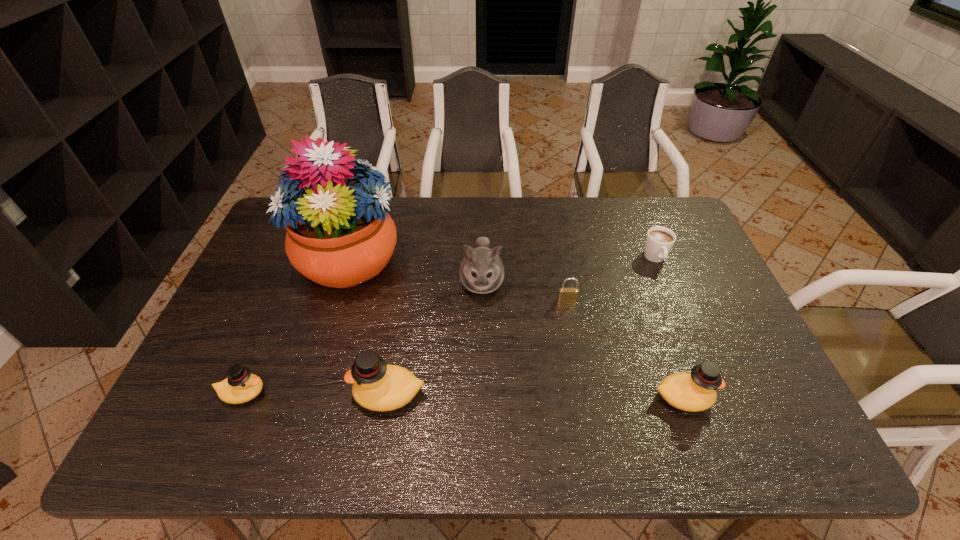
What are the coordinates of `vacant space located 0.050m on the front-facing side of the tallest duck` in the screenshot? It's located at click(330, 394).

At what (x,y) coordinates should I click in order to perform the action: click on free region located on the front-facing side of the tallest duck. Please return your answer as a coordinate pair (x, y). The width and height of the screenshot is (960, 540). Looking at the image, I should click on (193, 394).

Identify the location of blank area located on the front-facing side of the second shortest duck. (773, 397).

I want to click on free space located 0.180m on the face of the fourth object from left to right, so click(482, 359).

Where is `blank space located on the front of the tallest object`? Image resolution: width=960 pixels, height=540 pixels. blank space located on the front of the tallest object is located at coordinates (307, 409).

Image resolution: width=960 pixels, height=540 pixels. I want to click on free space located 0.360m with the handle on the side of the cappuccino, so click(702, 370).

At what (x,y) coordinates should I click in order to perform the action: click on vacant space located on the front-facing side of the fifth object from left to right. Please return your answer as a coordinate pair (x, y). The image size is (960, 540). Looking at the image, I should click on (574, 339).

Find the location of `object situated at the far edge`. object situated at the far edge is located at coordinates (339, 235).

Where is `duck located in the left edge section of the desktop`? duck located in the left edge section of the desktop is located at coordinates (241, 386).

Find the location of a particular element. flower arrangement present at the left edge is located at coordinates (339, 235).